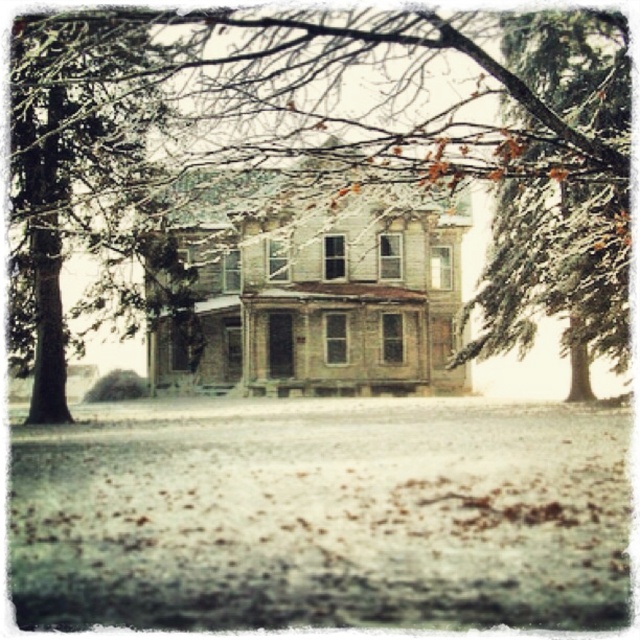
You are a delivery drone with a maximum flight range of 20 feet. You need to deliver a package from the white fluffy snow at lower center to the green textured pine tree at upper right. Can you complete the delivery without needing to recharge?

The distance between the white fluffy snow at lower center and the green textured pine tree at upper right is 20.79 feet. Since your drone has a maximum flight range of 20 feet, it cannot complete the delivery without needing to recharge as the required distance exceeds its capacity.

You are standing in the snowy landscape and want to take a photo of the house. The white fluffy snow at lower center and the green textured pine tree at upper right are both in your view. Which object will appear closer to the camera in the photo?

The white fluffy snow at lower center will appear closer to the camera in the photo because it is smaller than the green textured pine tree at upper right, indicating it is farther away from the camera.